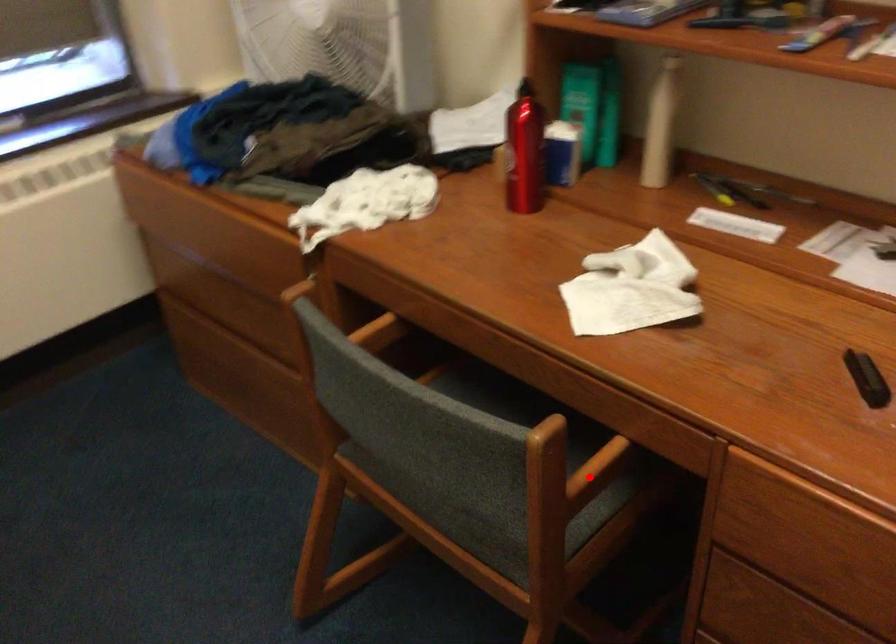
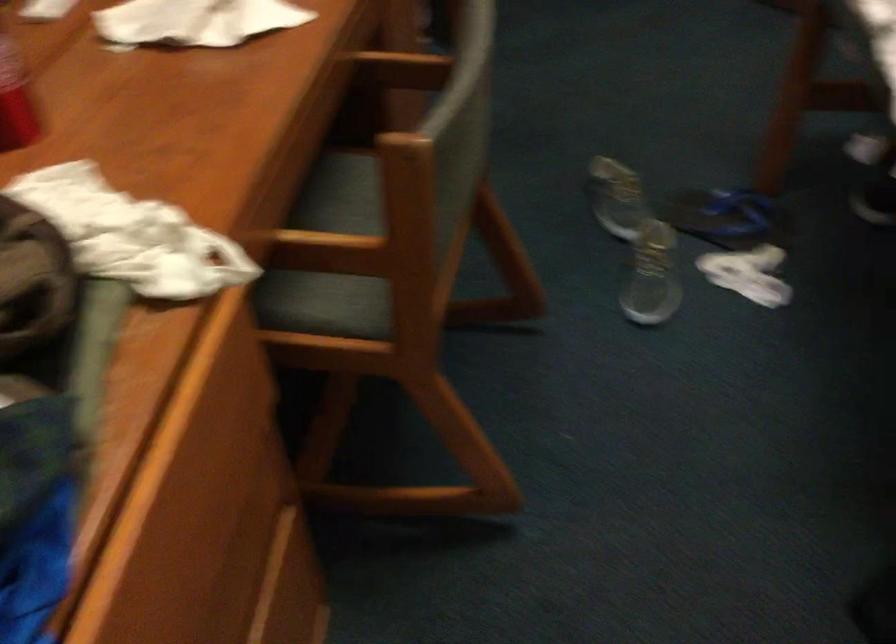
Where in the second image is the point corresponding to the highlighted location from the first image?

(401, 69)